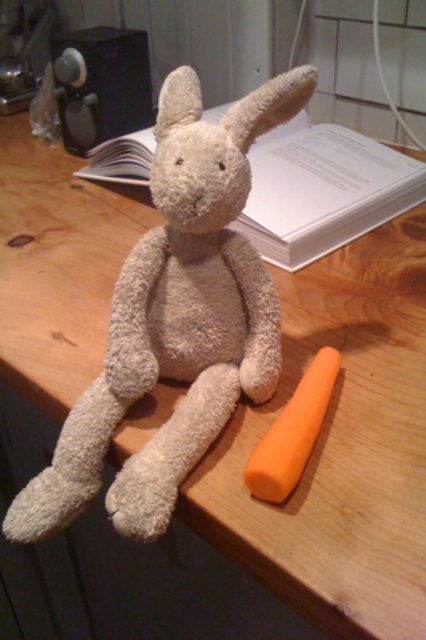
Consider the image. You are a small toy rabbit that wants to reach the carrot. The white paper at upper center is in the way. Can you move around it to get to the orange matte carrot at lower right if you can move 45 centimeters sideways?

The distance between the white paper at upper center and orange matte carrot at lower right is 40.85 centimeters. Since the rabbit can move 45 centimeters sideways, it has enough space to maneuver around the white paper at upper center and reach the orange matte carrot at lower right.

You are organizing a craft project and need to place the white paper at upper center and the orange matte carrot at lower right on a shelf. If the shelf has limited space, which object should you prioritize placing first to ensure both fit?

The white paper at upper center might be wider than the orange matte carrot at lower right, so you should prioritize placing the orange matte carrot at lower right first to accommodate the wider white paper at upper center.

You are an AI analyzing the image. The white paper at upper center is part of the scene. What are its coordinates?

The white paper at upper center is located at coordinates point [322,189].